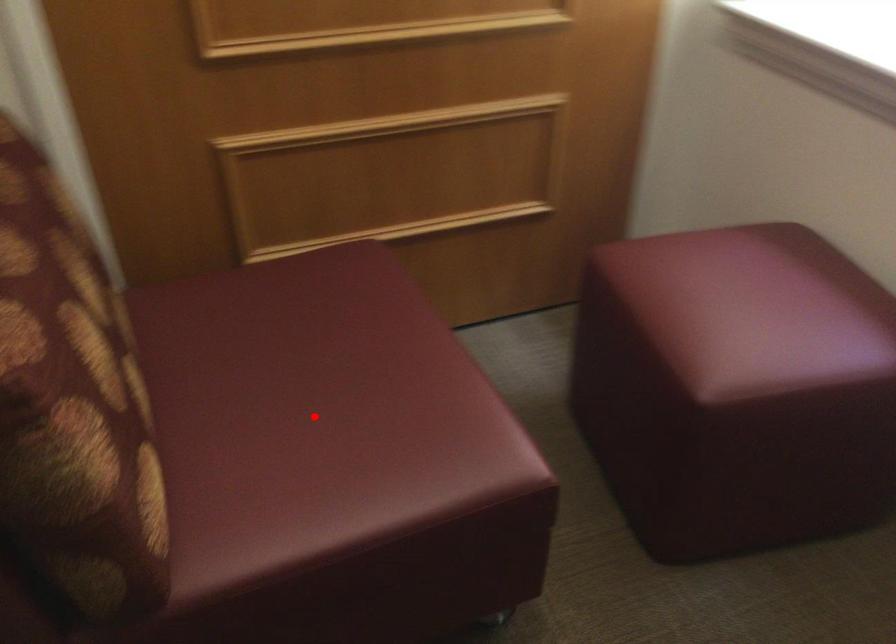
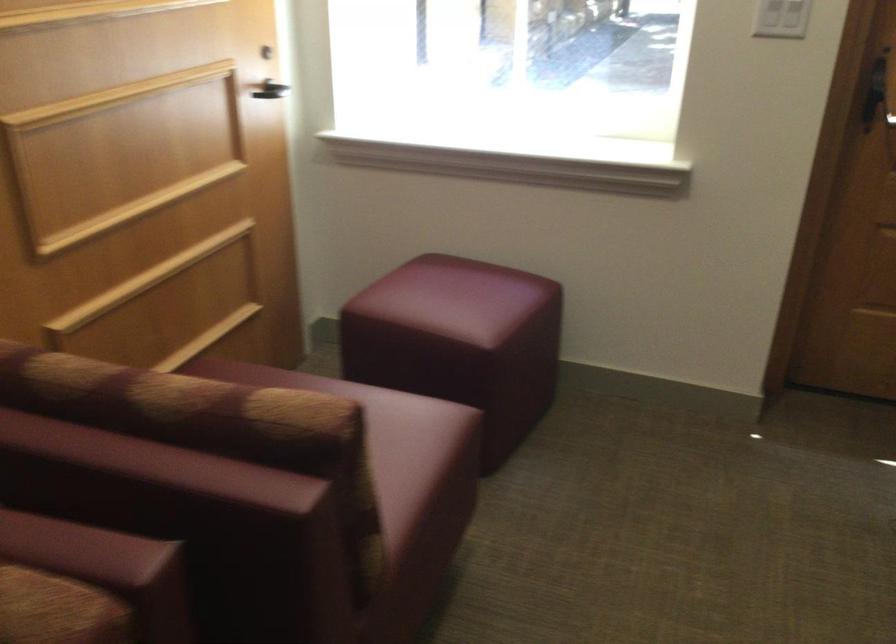
Question: I am providing you with two images of the same scene from different viewpoints. A red point is marked on the first image. Can you still see the location of the red point in image 2?

Choices:
 (A) Yes
 (B) No

Answer: (B)